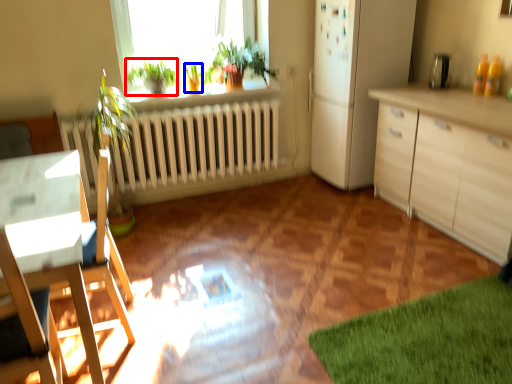
Question: Among these objects, which one is nearest to the camera, plant (highlighted by a red box) or plant (highlighted by a blue box)?

Choices:
 (A) plant
 (B) plant

Answer: (A)